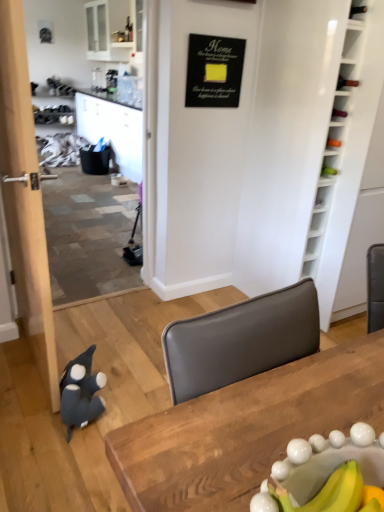
Question: Is white wood bookshelf at right smaller than dark gray plush penguin at lower left?

Choices:
 (A) yes
 (B) no

Answer: (B)

Question: Does white wood bookshelf at right have a greater width compared to dark gray plush penguin at lower left?

Choices:
 (A) no
 (B) yes

Answer: (B)

Question: From a real-world perspective, is white wood bookshelf at right over dark gray plush penguin at lower left?

Choices:
 (A) yes
 (B) no

Answer: (A)

Question: Is white wood bookshelf at right facing away from dark gray plush penguin at lower left?

Choices:
 (A) yes
 (B) no

Answer: (B)

Question: Is white wood bookshelf at right bigger than dark gray plush penguin at lower left?

Choices:
 (A) no
 (B) yes

Answer: (B)

Question: Is black matte signboard at upper center in front of or behind dark gray plush penguin at lower left in the image?

Choices:
 (A) behind
 (B) front

Answer: (A)

Question: In terms of width, does black matte signboard at upper center look wider or thinner when compared to dark gray plush penguin at lower left?

Choices:
 (A) wide
 (B) thin

Answer: (B)

Question: Is black matte signboard at upper center inside the boundaries of dark gray plush penguin at lower left, or outside?

Choices:
 (A) outside
 (B) inside

Answer: (A)

Question: From a real-world perspective, is black matte signboard at upper center physically located above or below dark gray plush penguin at lower left?

Choices:
 (A) below
 (B) above

Answer: (B)

Question: From the image's perspective, is wooden table at center above or below white wood bookshelf at right?

Choices:
 (A) above
 (B) below

Answer: (B)

Question: Does point (223, 456) appear closer or farther from the camera than point (256, 181)?

Choices:
 (A) farther
 (B) closer

Answer: (B)

Question: From a real-world perspective, relative to white wood bookshelf at right, is wooden table at center vertically above or below?

Choices:
 (A) above
 (B) below

Answer: (B)

Question: Is wooden table at center in front of or behind white wood bookshelf at right in the image?

Choices:
 (A) behind
 (B) front

Answer: (B)

Question: In the image, is wooden table at center on the left side or the right side of dark gray plush penguin at lower left?

Choices:
 (A) right
 (B) left

Answer: (A)

Question: Considering the positions of wooden table at center and dark gray plush penguin at lower left in the image, is wooden table at center bigger or smaller than dark gray plush penguin at lower left?

Choices:
 (A) big
 (B) small

Answer: (A)